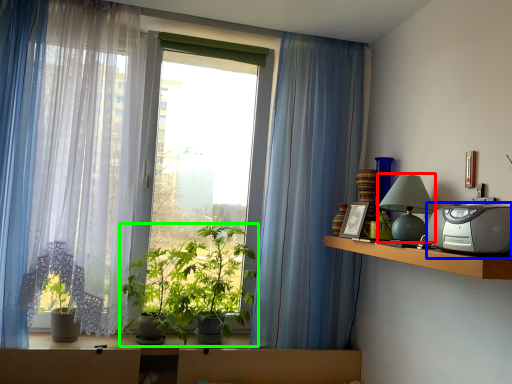
Question: Considering the real-world distances, which object is closest to table lamp (highlighted by a red box)? appliance (highlighted by a blue box) or houseplant (highlighted by a green box).

Choices:
 (A) appliance
 (B) houseplant

Answer: (A)